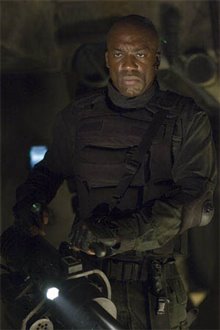
Find the location of a particular element. This screenshot has width=220, height=330. light is located at coordinates (53, 293).